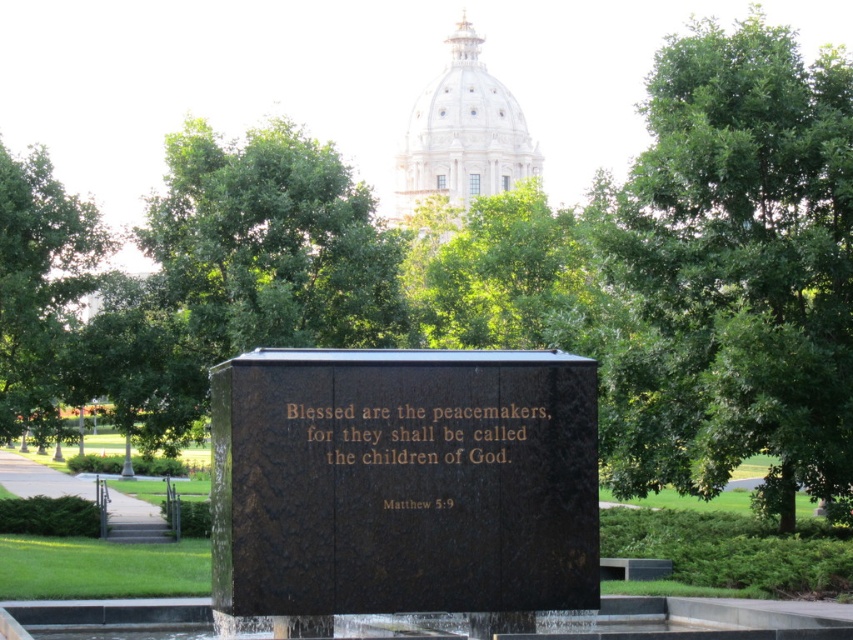
You are a photographer standing in front of the monument. You want to take a photo that includes both the inscription and the waterfall effect. The inscription is located at point (582,580) and the waterfall is at point (67,280). Which point should you focus on first to ensure both areas are in sharp focus?

You should focus on point (582,580) first because it is closer to the camera than point (67,280). This will ensure the inscription is in focus, and the waterfall will also be sharp as it is further back.